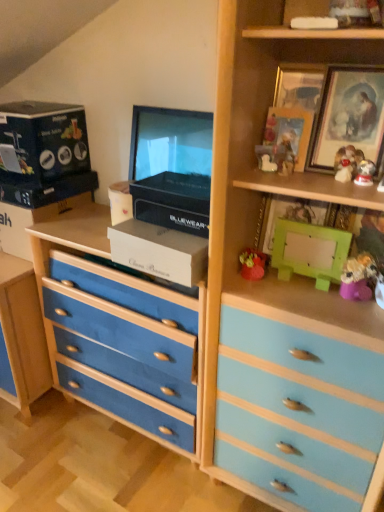
What are the coordinates of `empty space that is ontop of white cardboard box at center, the 3th box viewed from the left (from a real-world perspective)` in the screenshot? It's located at (162, 228).